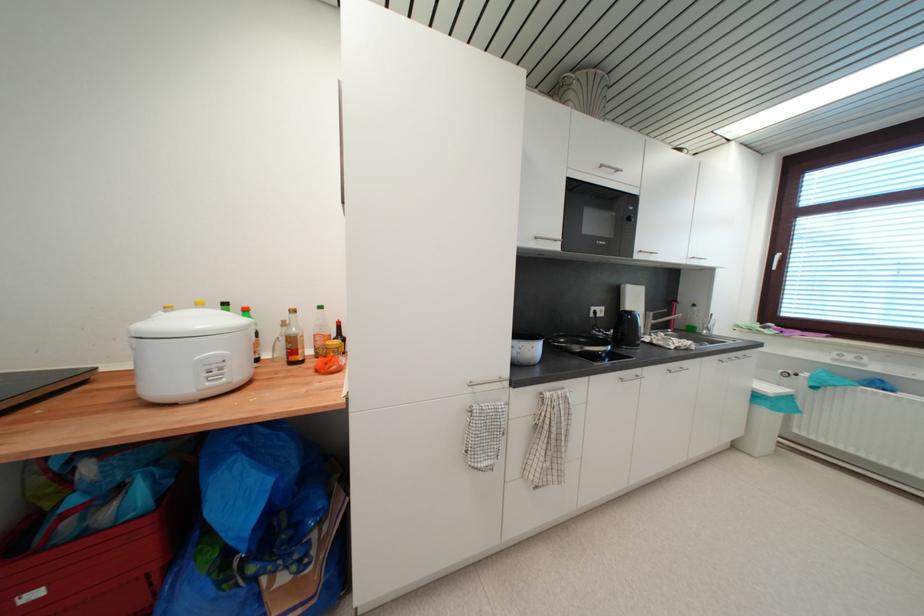
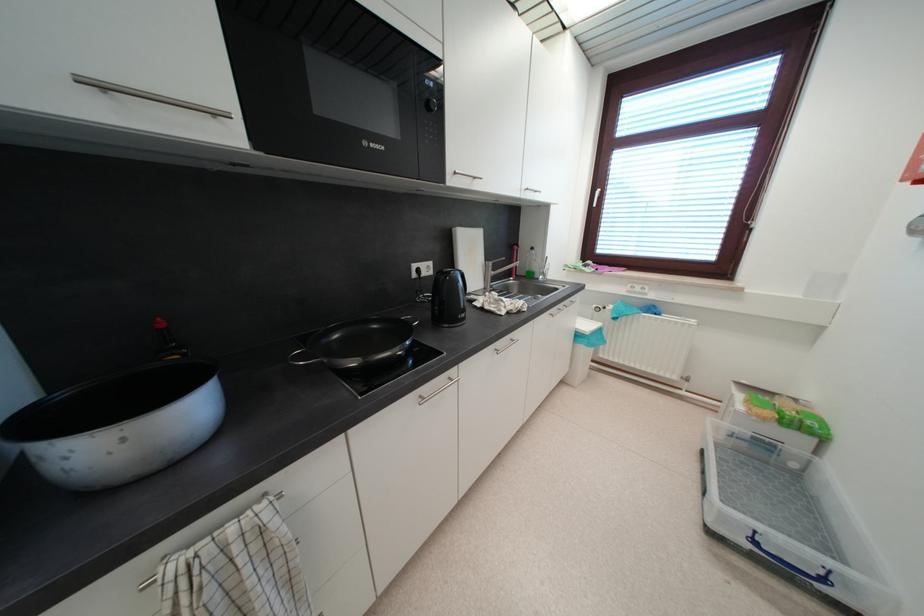
The point at [561,243] is marked in the first image. Where is the corresponding point in the second image?

(220, 116)